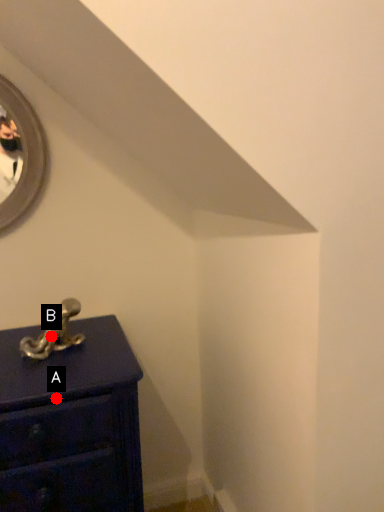
Question: Two points are circled on the image, labeled by A and B beside each circle. Which point is farther to the camera?

Choices:
 (A) A is further
 (B) B is further

Answer: (B)